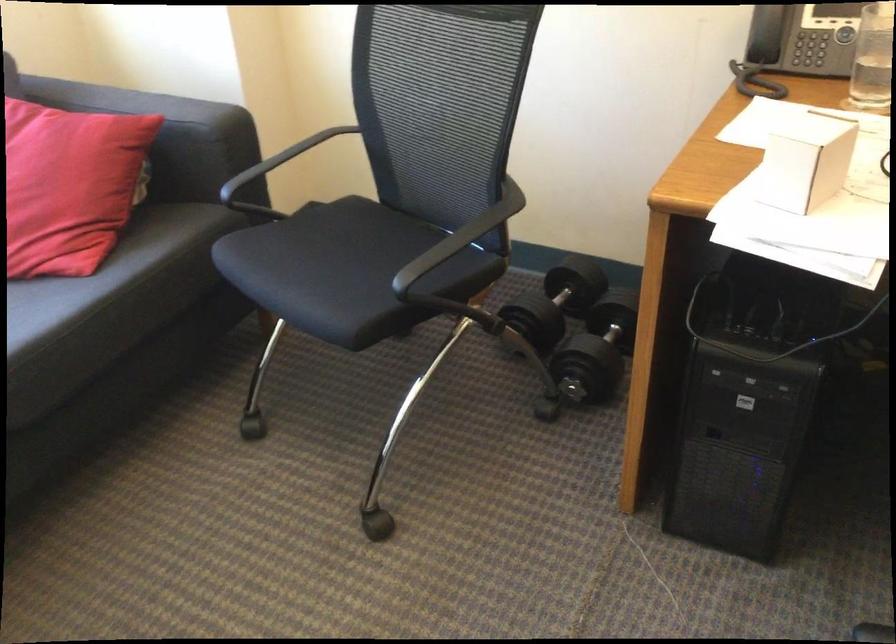
Describe the element at coordinates (767, 33) in the screenshot. The image size is (896, 644). I see `the telephone handset` at that location.